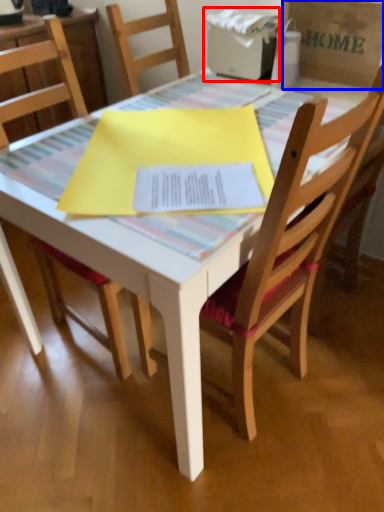
Question: Which object is closer to the camera taking this photo, printer (highlighted by a red box) or cardboard box (highlighted by a blue box)?

Choices:
 (A) printer
 (B) cardboard box

Answer: (B)